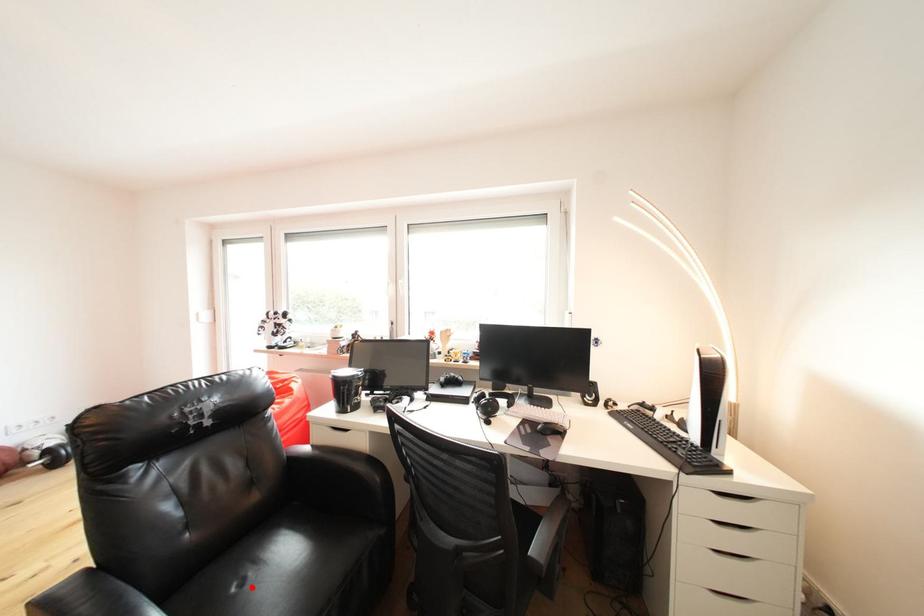
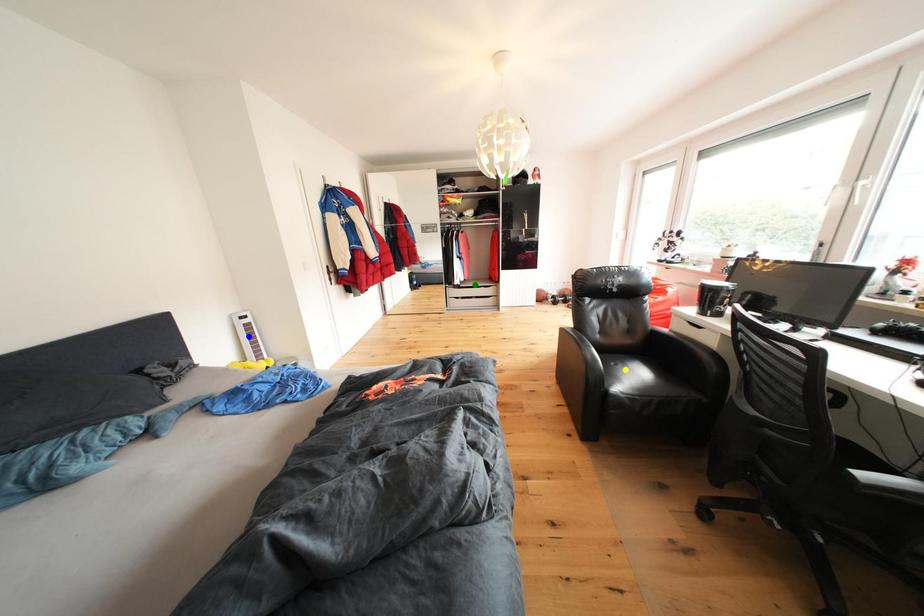
Question: I am providing you with two images of the same scene from different viewpoints. A red point is marked on the first image. You are given multiple points on the second image. Which mark in image 2 goes with the point in image 1?

Choices:
 (A) blue point
 (B) yellow point
 (C) green point

Answer: (B)